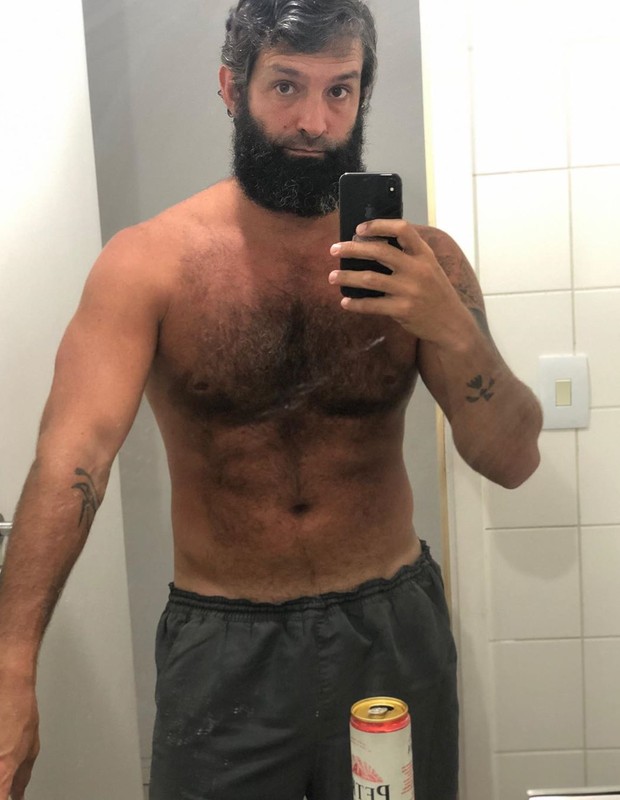
Image resolution: width=620 pixels, height=800 pixels. What are the coordinates of `white door` in the screenshot? It's located at (94, 738), (105, 550), (38, 298), (41, 86).